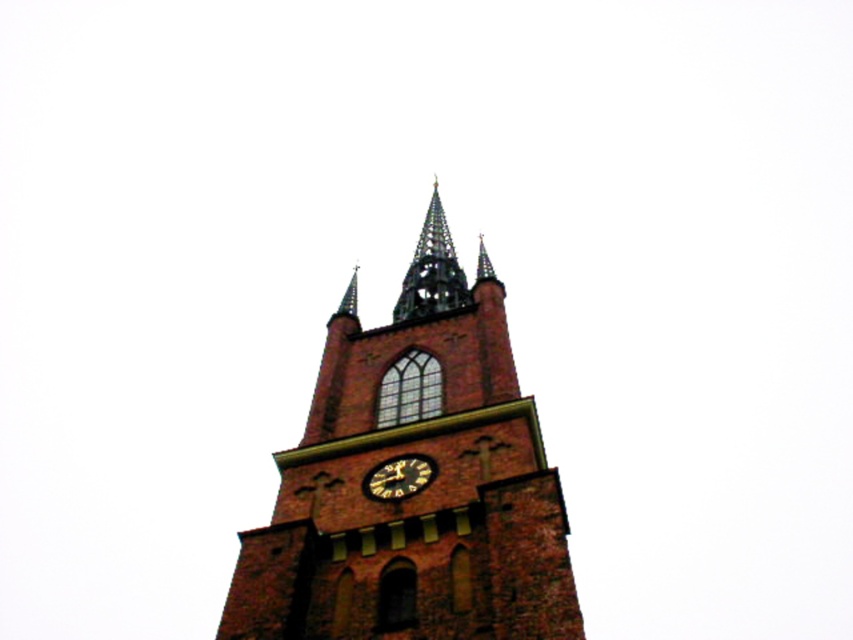
You are standing in front of the church tower and want to determine the relative positions of two points marked on the tower. The first point is at coordinate point (407,509) and the second is at point (421,257). From your perspective, which point appears closer to you?

Point (407,509) is in front of point (421,257), so it appears closer to you.

From the picture: You are a window cleaner standing on a platform that can only move vertically. You need to clean both the brick tower at center and the gold textured clock at center. Which object should you clean first if you start from the bottom of the tower?

The gold textured clock at center should be cleaned first because the brick tower at center is located above it, so starting from the bottom allows you to reach the clock before ascending higher.

You are standing in front of the brick tower at center and looking upwards. There is a dark gray stone spire at upper center above it. Which one is closer to your eyes?

The brick tower at center is closer to the viewer than the dark gray stone spire at upper center.